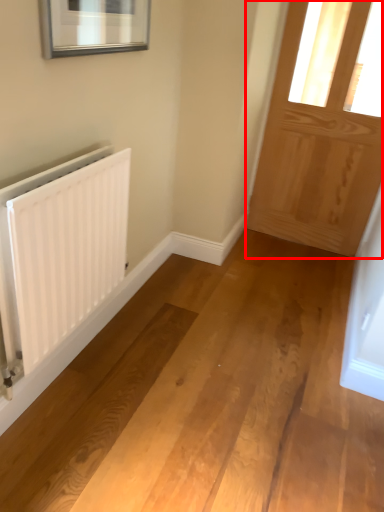
Question: From the image's perspective, where is door (annotated by the red box) located in relation to radiator in the image?

Choices:
 (A) above
 (B) below

Answer: (A)